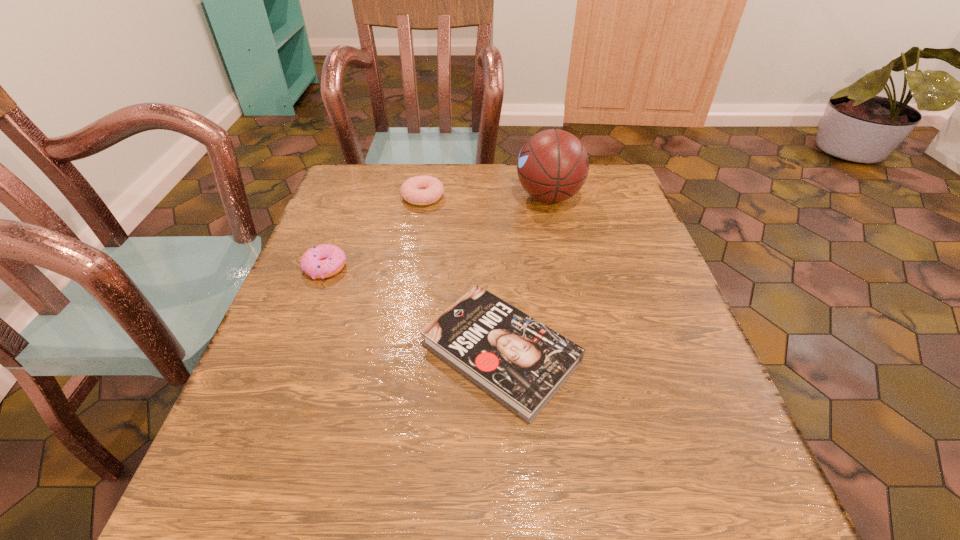
What are the coordinates of `vacant region at the far right corner of the desktop` in the screenshot? It's located at (591, 176).

I want to click on free spot between the nearest object and the farther doughnut, so click(x=462, y=275).

The width and height of the screenshot is (960, 540). I want to click on free space between the shortest object and the nearer doughnut, so click(413, 310).

In order to click on free area in between the tallest object and the shortest object in this screenshot , I will do `click(524, 275)`.

What are the coordinates of `free space between the nearest object and the farther doughnut` in the screenshot? It's located at (462, 275).

Where is `free spot between the basketball and the right doughnut`? This screenshot has width=960, height=540. free spot between the basketball and the right doughnut is located at coordinates (486, 197).

The height and width of the screenshot is (540, 960). I want to click on free space between the tallest object and the book, so click(x=524, y=275).

Identify the location of blank region between the book and the tallest object. (524, 275).

Image resolution: width=960 pixels, height=540 pixels. Find the location of `vacant space in between the right doughnut and the nearest object`. vacant space in between the right doughnut and the nearest object is located at coordinates (462, 275).

Where is `empty space between the right doughnut and the nearest object`? This screenshot has width=960, height=540. empty space between the right doughnut and the nearest object is located at coordinates (462, 275).